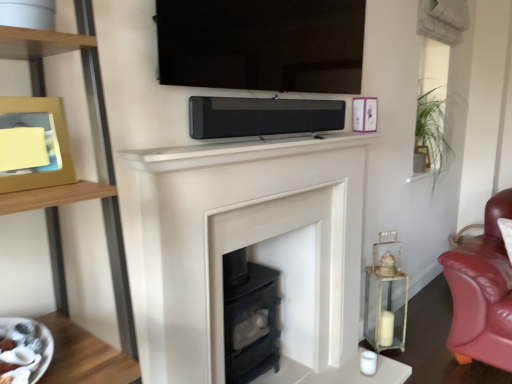
I want to click on vacant area that is situated to the right of clear glass lantern at right, so click(418, 350).